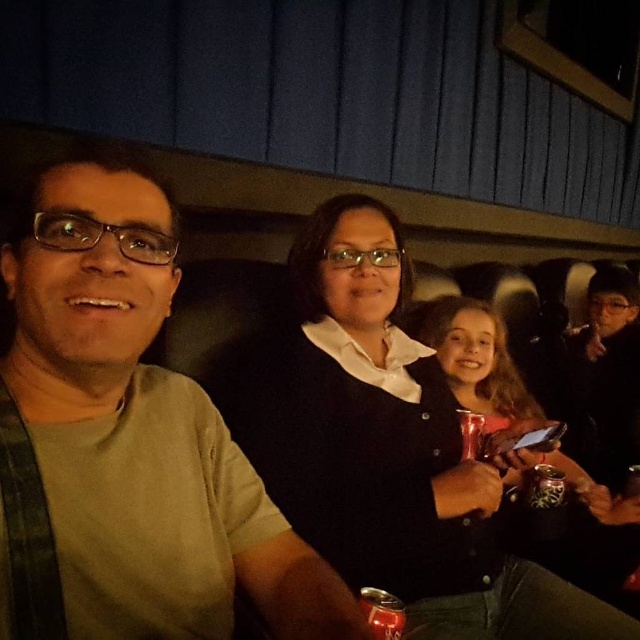
Who is positioned more to the right, matte green shirt at left or black matte sweater at center?

black matte sweater at center

Who is more distant from viewer, (51,328) or (483,486)?

Positioned behind is point (483,486).

This screenshot has height=640, width=640. What do you see at coordinates (128, 444) in the screenshot?
I see `matte green shirt at left` at bounding box center [128, 444].

Where is `matte green shirt at left`? Image resolution: width=640 pixels, height=640 pixels. matte green shirt at left is located at coordinates (128, 444).

Find the location of `black matte sweater at center`. black matte sweater at center is located at coordinates (392, 451).

Is black matte sweater at center smaller than matte black shirt at center?

No, black matte sweater at center is not smaller than matte black shirt at center.

Who is more distant from viewer, (371, 328) or (602, 492)?

Positioned behind is point (602, 492).

The height and width of the screenshot is (640, 640). Find the location of `black matte sweater at center`. black matte sweater at center is located at coordinates (392, 451).

Is matte green shirt at left further to the viewer compared to matte black shirt at center?

That is False.

Is matte green shirt at left wider than matte black shirt at center?

No, matte green shirt at left is not wider than matte black shirt at center.

Who is more forward, (276, 540) or (589, 502)?

Point (276, 540)

The image size is (640, 640). In order to click on matte green shirt at left in this screenshot , I will do `click(128, 444)`.